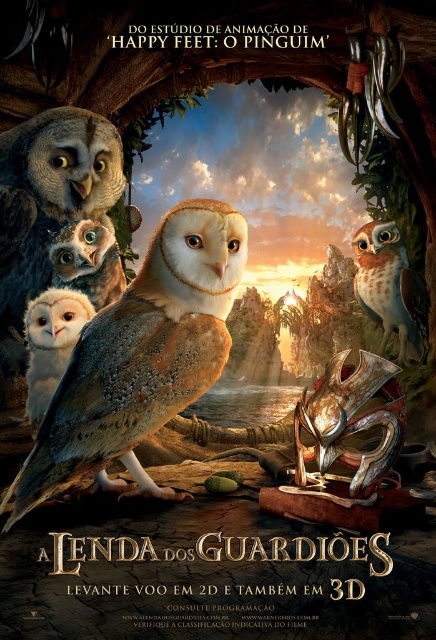
Who is lower down, rustic wood owl at right or matte brown owl at center?

Positioned lower is rustic wood owl at right.

Who is taller, rustic wood owl at right or matte brown owl at center?

rustic wood owl at right is taller.

Locate an element on the screen. This screenshot has height=640, width=436. rustic wood owl at right is located at coordinates (391, 288).

At what (x,y) coordinates should I click in order to perform the action: click on rustic wood owl at right. Please return your answer as a coordinate pair (x, y). Looking at the image, I should click on (391, 288).

At what (x,y) coordinates should I click in order to perform the action: click on brown speckled feathers owl at center. Please return your answer as a coordinate pair (x, y). The image size is (436, 640). Looking at the image, I should click on (142, 353).

Which is in front, point (152, 401) or point (414, 337)?

Point (152, 401) is more forward.

Is point (187, 204) farther from viewer compared to point (380, 256)?

No, (187, 204) is closer to viewer.

Where is `brown speckled feathers owl at center`? This screenshot has width=436, height=640. brown speckled feathers owl at center is located at coordinates (142, 353).

Who is higher up, white matte owl at lower left or matte brown owl at center?

matte brown owl at center

Between white matte owl at lower left and matte brown owl at center, which one appears on the left side from the viewer's perspective?

white matte owl at lower left is more to the left.

Where is `white matte owl at lower left`? This screenshot has width=436, height=640. white matte owl at lower left is located at coordinates (51, 342).